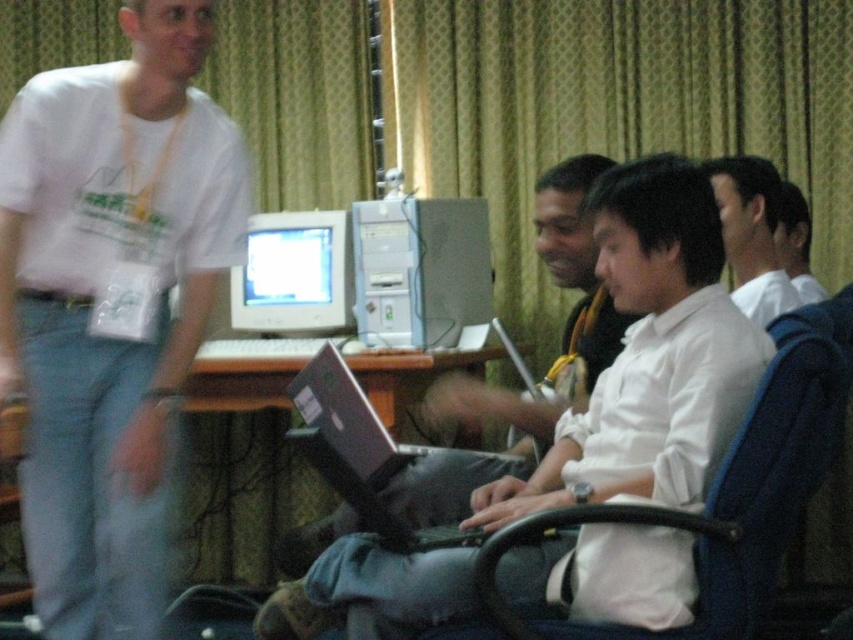
Is point (757, 218) positioned behind point (316, 372)?

Yes, point (757, 218) is farther from viewer.

Does point (758, 323) lie in front of point (352, 440)?

Yes, point (758, 323) is closer to viewer.

Identify the location of white shirt at center. This screenshot has width=853, height=640. (751, 234).

Is matte gray monitor at center to the left of silver metallic laptop at center from the viewer's perspective?

Indeed, matte gray monitor at center is positioned on the left side of silver metallic laptop at center.

Identify the location of matte gray monitor at center. This screenshot has width=853, height=640. (294, 275).

Does point (338, 243) come in front of point (384, 454)?

No, it is not.

Locate an element on the screen. This screenshot has height=640, width=853. matte gray monitor at center is located at coordinates (294, 275).

Between blue fabric swivel chair at center right and white shirt at center, which one has more height?

blue fabric swivel chair at center right is taller.

Which is in front, point (796, 374) or point (770, 276)?

Point (796, 374)

This screenshot has width=853, height=640. Describe the element at coordinates (727, 492) in the screenshot. I see `blue fabric swivel chair at center right` at that location.

Where is `blue fabric swivel chair at center right`? The image size is (853, 640). blue fabric swivel chair at center right is located at coordinates (727, 492).